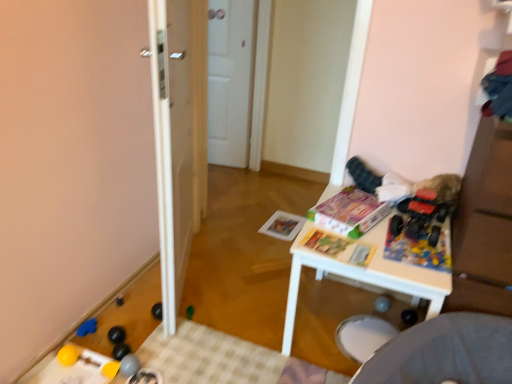
This screenshot has height=384, width=512. In order to click on blank space above matte paper magazine at center, the first magazine positioned from the front (from a real-world perspective) in this screenshot , I will do `click(331, 237)`.